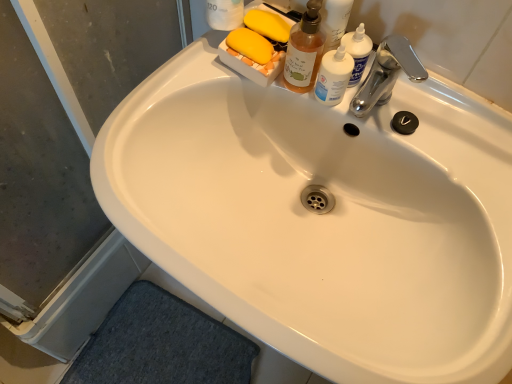
I want to click on blank area to the left of translucent amber liquid soap dispenser at upper center, so click(x=176, y=88).